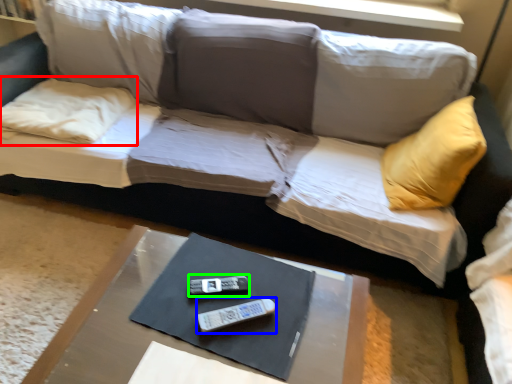
Question: Estimate the real-world distances between objects in this image. Which object is farther from pillow (highlighted by a red box), remote (highlighted by a blue box) or remote (highlighted by a green box)?

Choices:
 (A) remote
 (B) remote

Answer: (A)